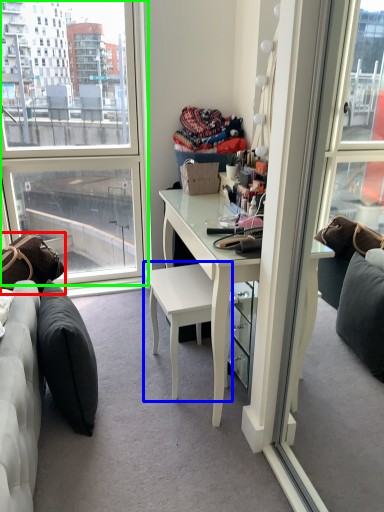
Question: Which is farther away from pillow (highlighted by a red box)? chair (highlighted by a blue box) or window (highlighted by a green box)?

Choices:
 (A) chair
 (B) window

Answer: (B)